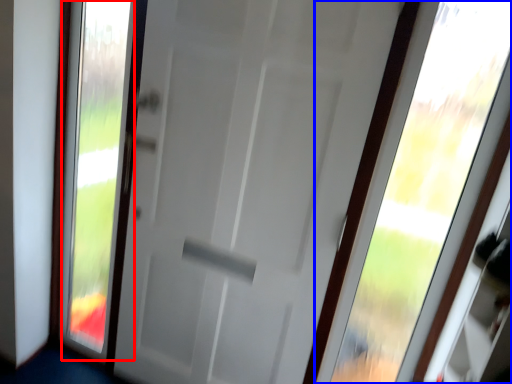
Question: Which of the following is the farthest to the observer, glass window (highlighted by a red box) or window (highlighted by a blue box)?

Choices:
 (A) glass window
 (B) window

Answer: (A)